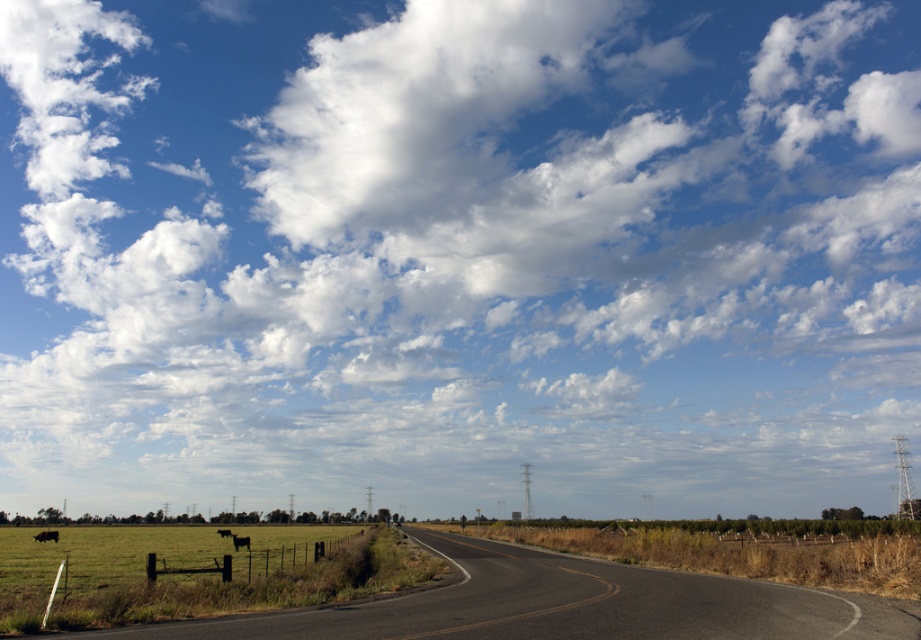
Which is above, black glossy cow at left or black matte cow at lower left?

Positioned higher is black glossy cow at left.

Between point (52, 536) and point (219, 529), which one is positioned behind?

Point (219, 529)

Image resolution: width=921 pixels, height=640 pixels. What are the coordinates of `black glossy cow at left` in the screenshot? It's located at (45, 536).

Describe the element at coordinates (240, 541) in the screenshot. I see `black furry cow at left` at that location.

Based on the photo, which is below, black furry cow at left or black glossy cow at left?

black glossy cow at left is below.

The width and height of the screenshot is (921, 640). In order to click on black furry cow at left in this screenshot , I will do `click(240, 541)`.

Who is more distant from viewer, (884, 616) or (41, 534)?

Positioned behind is point (41, 534).

Between black asphalt highway at lower center and black glossy cow at left, which one has less height?

black glossy cow at left is shorter.

Locate an element on the screen. The image size is (921, 640). black asphalt highway at lower center is located at coordinates click(517, 600).